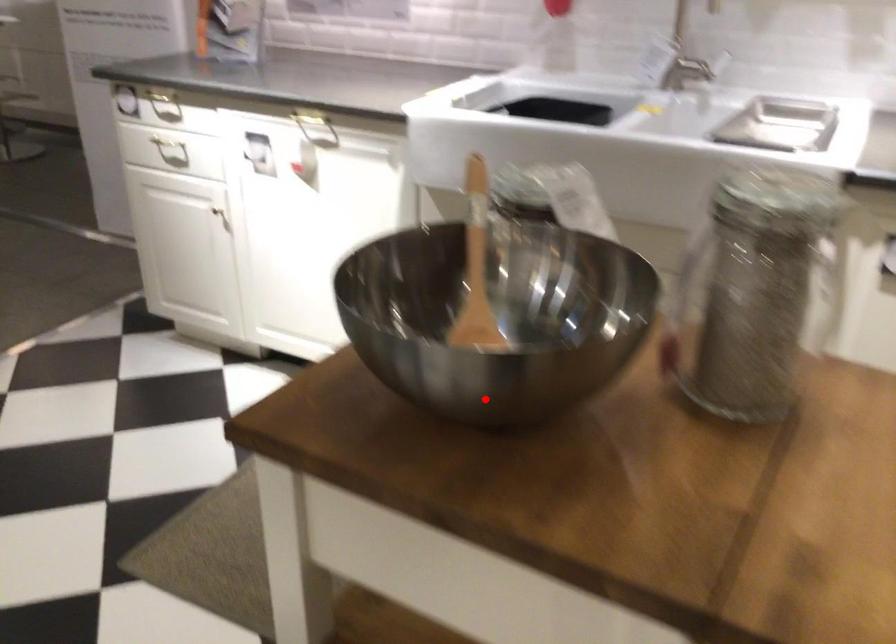
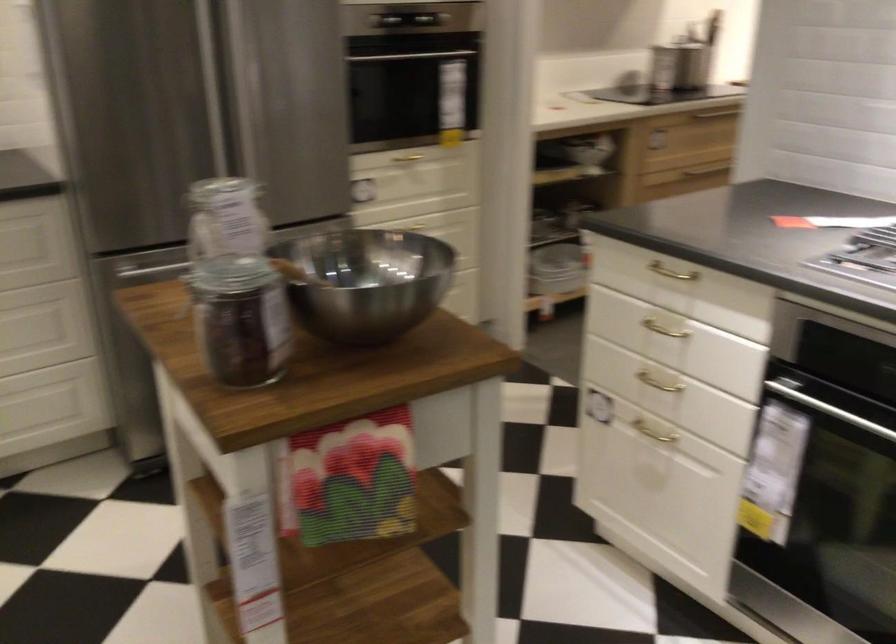
Question: I am providing you with two images of the same scene from different viewpoints. Image1 has a red point marked. In image2, the corresponding 3D location appears at what relative position? Reply with the corresponding letter.

Choices:
 (A) Closer
 (B) Farther

Answer: (B)